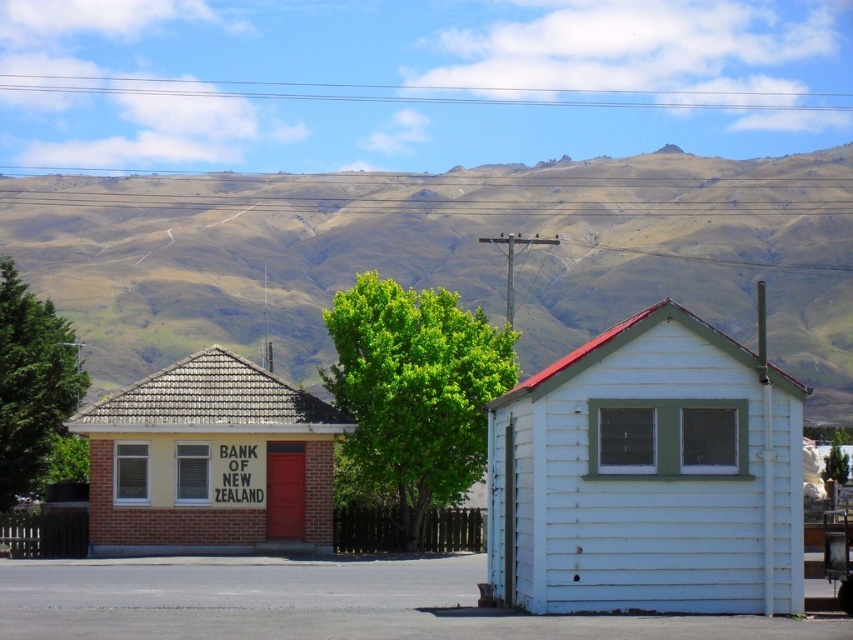
Can you confirm if yellow brick building at center is positioned above green leafy tree at center?

Incorrect, yellow brick building at center is not positioned above green leafy tree at center.

Does yellow brick building at center have a larger size compared to green leafy tree at center?

Actually, yellow brick building at center might be smaller than green leafy tree at center.

Is point (128, 522) in front of point (403, 294)?

Yes, it is.

You are a GUI agent. You are given a task and a screenshot of the screen. Output one action in this format:
    pyautogui.click(x=<x>, y=<y>)
    Task: Click on the yellow brick building at center
    
    Given the screenshot: What is the action you would take?
    pyautogui.click(x=210, y=461)

Does brown grassy hillside at upper center have a greater height compared to white wood cabin at center?

Indeed, brown grassy hillside at upper center has a greater height compared to white wood cabin at center.

Does brown grassy hillside at upper center have a lesser width compared to white wood cabin at center?

Incorrect, brown grassy hillside at upper center's width is not less than white wood cabin at center's.

The height and width of the screenshot is (640, 853). What do you see at coordinates (445, 253) in the screenshot?
I see `brown grassy hillside at upper center` at bounding box center [445, 253].

Identify the location of brown grassy hillside at upper center. This screenshot has height=640, width=853. (445, 253).

Who is shorter, brown grassy hillside at upper center or green leafy tree at left?

green leafy tree at left

Which is behind, point (711, 186) or point (19, 424)?

Point (711, 186)

Is point (491, 179) positioned after point (76, 358)?

Yes, it is behind point (76, 358).

Image resolution: width=853 pixels, height=640 pixels. I want to click on brown grassy hillside at upper center, so click(445, 253).